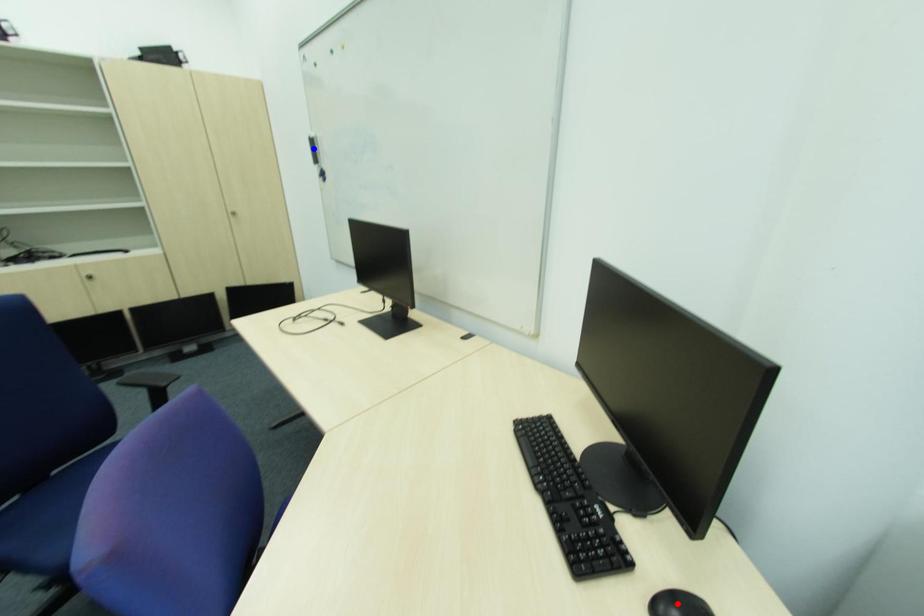
Question: In the image, two points are highlighted. Which point is nearer to the camera? Reply with the corresponding letter.

Choices:
 (A) blue point
 (B) red point

Answer: (B)